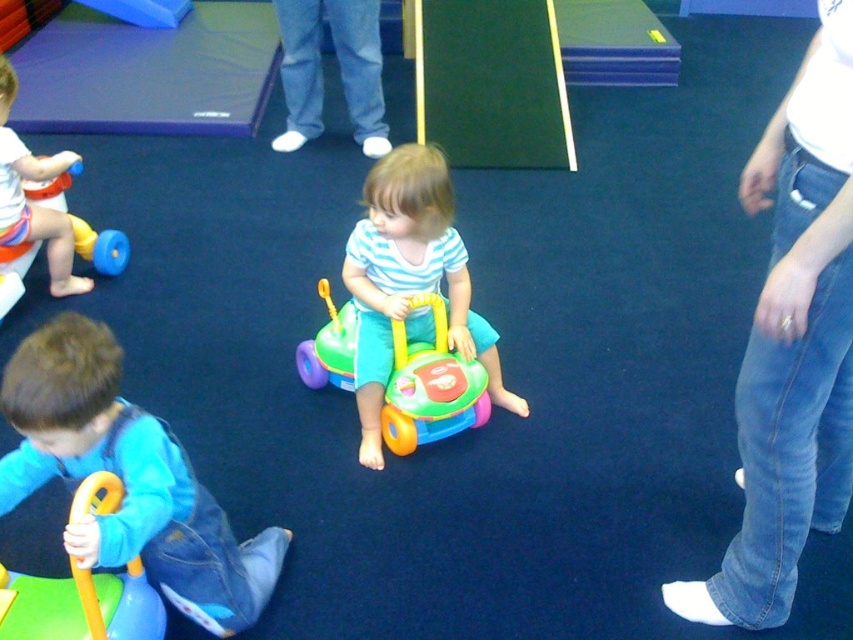
Is blue denim jacket at lower left above striped cotton shirt at center?

Incorrect, blue denim jacket at lower left is not positioned above striped cotton shirt at center.

Does blue denim jacket at lower left have a smaller size compared to striped cotton shirt at center?

Yes, blue denim jacket at lower left is smaller than striped cotton shirt at center.

Based on the photo, measure the distance between point (114, 369) and camera.

1.32 meters

Locate an element on the screen. blue denim jacket at lower left is located at coordinates (126, 477).

Is striped cotton shirt at center wider than multicolored plastic walker at center?

In fact, striped cotton shirt at center might be narrower than multicolored plastic walker at center.

Does point (376, 317) come behind point (294, 360)?

No, it is in front of (294, 360).

Image resolution: width=853 pixels, height=640 pixels. I want to click on striped cotton shirt at center, so click(x=410, y=282).

Can you confirm if multicolored plastic walker at center is positioned to the left of rubber yellow walker at lower left?

No, multicolored plastic walker at center is not to the left of rubber yellow walker at lower left.

Does multicolored plastic walker at center have a greater height compared to rubber yellow walker at lower left?

Result: Correct, multicolored plastic walker at center is much taller as rubber yellow walker at lower left.

At what (x,y) coordinates should I click in order to perform the action: click on multicolored plastic walker at center. Please return your answer as a coordinate pair (x, y). The width and height of the screenshot is (853, 640). Looking at the image, I should click on (430, 385).

Find the location of a particular element. This screenshot has width=853, height=640. multicolored plastic walker at center is located at coordinates (430, 385).